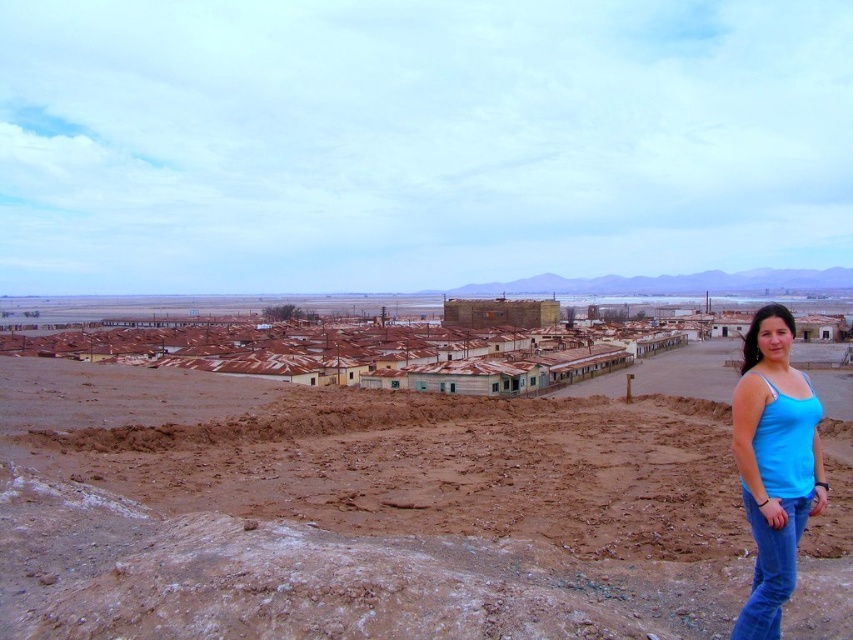
You are a surveyor measuring distances between landmarks in this desert scene. You have a drone that can fly up to 100 meters. Can your drone reach the rusty metal rooftops at center from the brown sandy dirt field at lower center without exceeding its maximum range?

The brown sandy dirt field at lower center is 102.13 meters from the rusty metal rooftops at center. Since the drone can only fly up to 100 meters, it cannot reach the rusty metal rooftops at center from the brown sandy dirt field at lower center without exceeding its maximum range.

You are standing in the desert landscape and want to walk from the rusty metal rooftops at center to the blue cotton tank top at lower right. Which direction should you move relative to your current position?

Since the rusty metal rooftops at center are closer to you than the blue cotton tank top at lower right, you should move forward towards the blue cotton tank top at lower right to reach it.

From the picture: You are navigating through the arid landscape and see two points marked on your map. The first point is at coordinate point (363, 339) and the second is at coordinate point (747, 522). Which point is closer to you as you stand in the foreground of the image?

Point (747, 522) is closer to you because it is in front of point (363, 339), which is further back in the image.